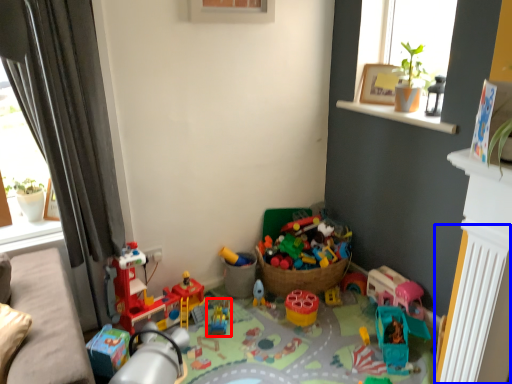
Question: Which point is closer to the camera, toy (highlighted by a red box) or radiator (highlighted by a blue box)?

Choices:
 (A) toy
 (B) radiator

Answer: (B)